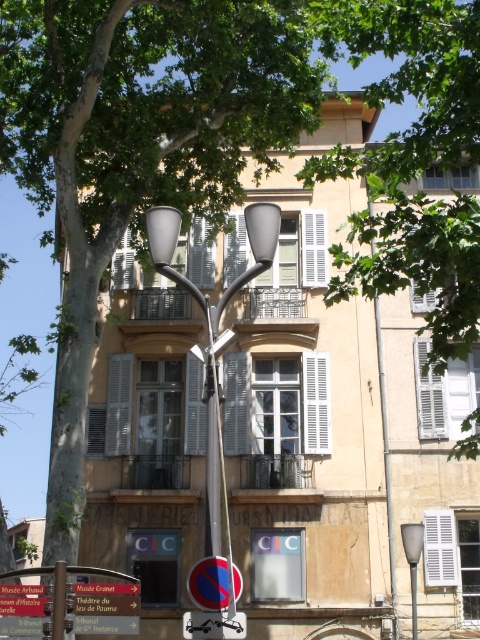
Question: Can you confirm if satin silver streetlight at center is positioned to the right of metallic reflective tow truck at lower center?

Choices:
 (A) yes
 (B) no

Answer: (A)

Question: Is metallic reflective tow truck at lower center positioned behind matte gray streetlight at right?

Choices:
 (A) yes
 (B) no

Answer: (B)

Question: Which point is closer to the camera?

Choices:
 (A) (403, 538)
 (B) (275, 221)

Answer: (B)

Question: Does metallic reflective tow truck at lower center appear on the right side of matte gray streetlight at right?

Choices:
 (A) yes
 (B) no

Answer: (B)

Question: Which of the following is the farthest from the observer?

Choices:
 (A) (202, 563)
 (B) (415, 572)
 (C) (403, 529)
 (D) (215, 616)

Answer: (C)

Question: Which object is positioned farthest from the metallic reflective tow truck at lower center?

Choices:
 (A) green leafy tree at upper center
 (B) matte gray streetlight at right

Answer: (A)